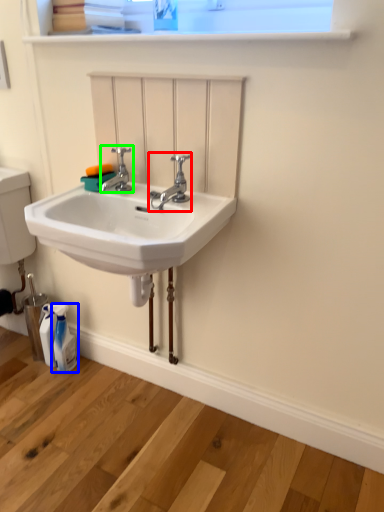
Question: Which object is positioned farthest from tap (highlighted by a red box)? Select from toiletry (highlighted by a blue box) and tap (highlighted by a green box).

Choices:
 (A) toiletry
 (B) tap

Answer: (A)